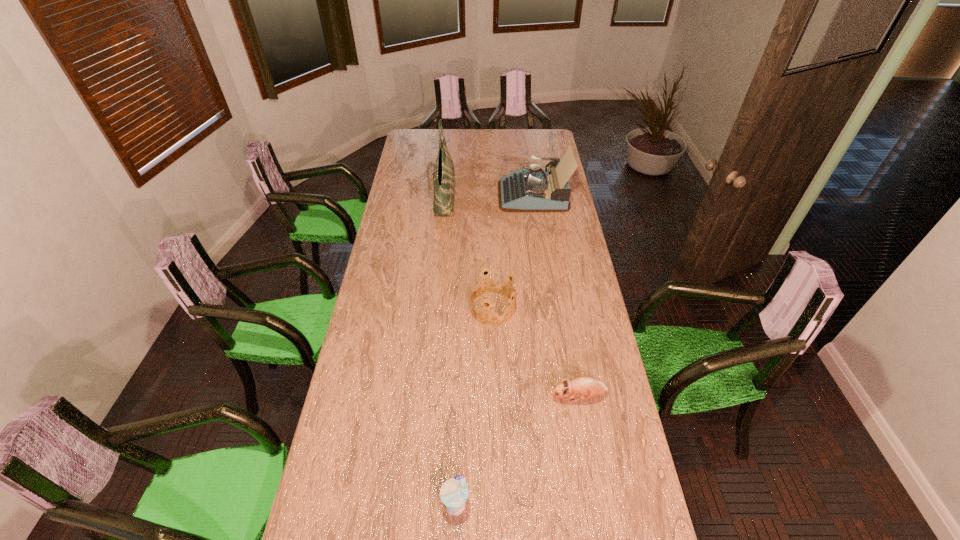
This screenshot has width=960, height=540. What are the coordinates of `vacant region located 0.280m on the typing side of the typewriter` in the screenshot? It's located at (444, 194).

The height and width of the screenshot is (540, 960). In order to click on vacant space located 0.190m on the front of the third shortest object in this screenshot , I will do `click(494, 368)`.

Identify the location of free space located 0.230m at the face of the second nearest object. (481, 397).

You are a GUI agent. You are given a task and a screenshot of the screen. Output one action in this format:
    pyautogui.click(x=<x>, y=<y>)
    Task: Click on the vacant space located at the face of the second nearest object
    This screenshot has height=540, width=960.
    Given the screenshot: What is the action you would take?
    pyautogui.click(x=454, y=397)

Locate an element on the screen. The width and height of the screenshot is (960, 540). free space located 0.390m at the face of the second nearest object is located at coordinates (433, 397).

I want to click on free space located on the back of the yogurt, so click(x=460, y=400).

Locate an element on the screen. typewriter situated at the right edge is located at coordinates (531, 189).

Where is `hamster located in the right edge section of the desktop`? This screenshot has width=960, height=540. hamster located in the right edge section of the desktop is located at coordinates (584, 387).

At what (x,y) coordinates should I click in order to perform the action: click on vacant space at the far edge of the desktop. Please return your answer as a coordinate pair (x, y). The image size is (960, 540). Looking at the image, I should click on (483, 143).

You are a GUI agent. You are given a task and a screenshot of the screen. Output one action in this format:
    pyautogui.click(x=<x>, y=<y>)
    Task: Click on the vacant region at the left edge
    The height and width of the screenshot is (540, 960).
    Given the screenshot: What is the action you would take?
    pyautogui.click(x=421, y=151)